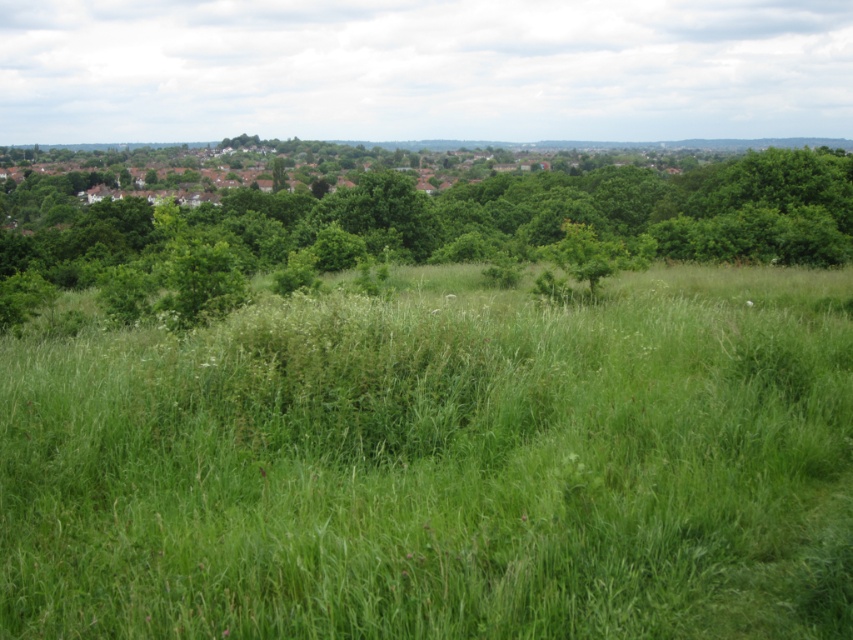
You are a drone operator trying to capture aerial footage of the green grassy field at center and the green leafy tree at upper center. Based on their sizes in the image, which object would appear smaller in the footage?

The green grassy field at center is thinner than the green leafy tree at upper center, so the green grassy field at center would appear smaller in the footage.

You are standing in the middle of the green grassy field at center and want to look up at the green leafy tree at upper center. In which direction should you look?

You should look upwards because the green grassy field at center is located below the green leafy tree at upper center.

You are a landscape architect designing a new park. You have to place a statue in the green grassy field at center and a bench under the green leafy tree at upper center. Which area has enough space to accommodate both the statue and the bench without overcrowding?

The green leafy tree at upper center has more space since it is larger than the green grassy field at center, so placing the bench there would provide sufficient space. The statue can be placed in the smaller green grassy field at center as it requires less area.